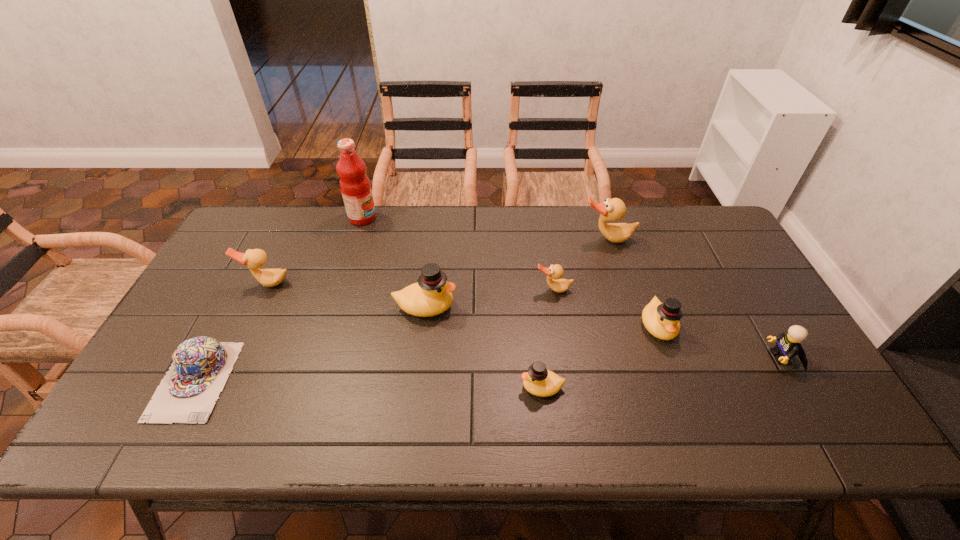
This screenshot has width=960, height=540. I want to click on cap at the left edge, so click(200, 366).

This screenshot has height=540, width=960. I want to click on object located in the right edge section of the desktop, so pos(788,345).

You are a GUI agent. You are given a task and a screenshot of the screen. Output one action in this format:
    pyautogui.click(x=<x>, y=<y>)
    Task: Click on the object at the near left corner
    This screenshot has height=540, width=960.
    Given the screenshot: What is the action you would take?
    pyautogui.click(x=200, y=366)

Find the location of `vacant space at the far edge`. vacant space at the far edge is located at coordinates (309, 238).

Locate an element on the screen. This screenshot has height=540, width=960. vacant area at the right edge is located at coordinates (734, 254).

In the image, there is a desktop. Where is `vacant space at the far left corner`? The height and width of the screenshot is (540, 960). vacant space at the far left corner is located at coordinates (275, 219).

Locate an element on the screen. Image resolution: width=960 pixels, height=540 pixels. free spot between the second smallest yellow duck and the shortest object is located at coordinates (426, 353).

This screenshot has width=960, height=540. Find the location of `vacant area that lies between the smallest tan duck and the seventh object from right to left`. vacant area that lies between the smallest tan duck and the seventh object from right to left is located at coordinates (458, 254).

Identify the location of unoccupied position between the leftmost yellow duck and the leftmost duck. (347, 295).

Find the location of a particular element. The height and width of the screenshot is (540, 960). vacant area that lies between the tallest object and the rightmost object is located at coordinates (572, 287).